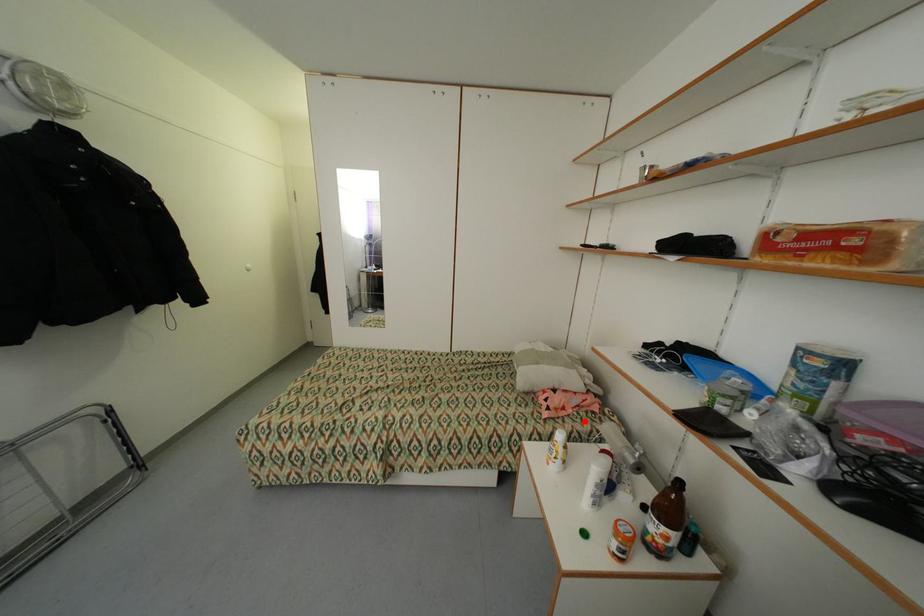
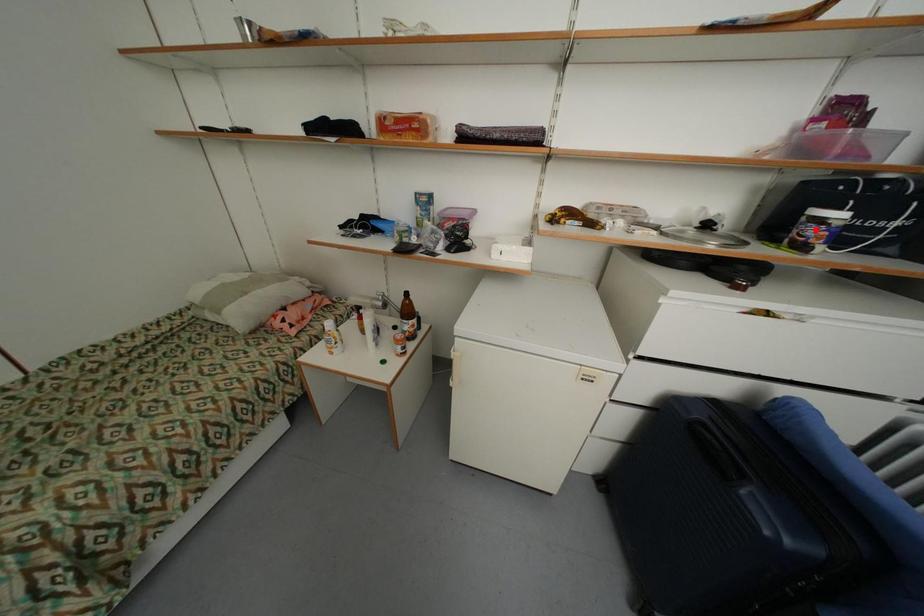
I am providing you with two images of the same scene from different viewpoints. A red point is marked on the first image and another point is marked on the second image. Do the highlighted points in image1 and image2 indicate the same real-world spot?

No